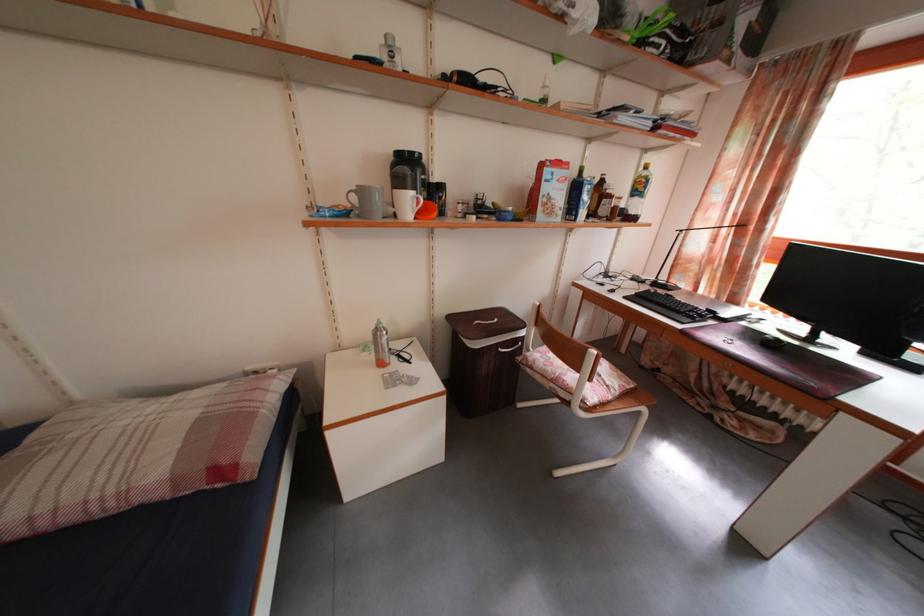
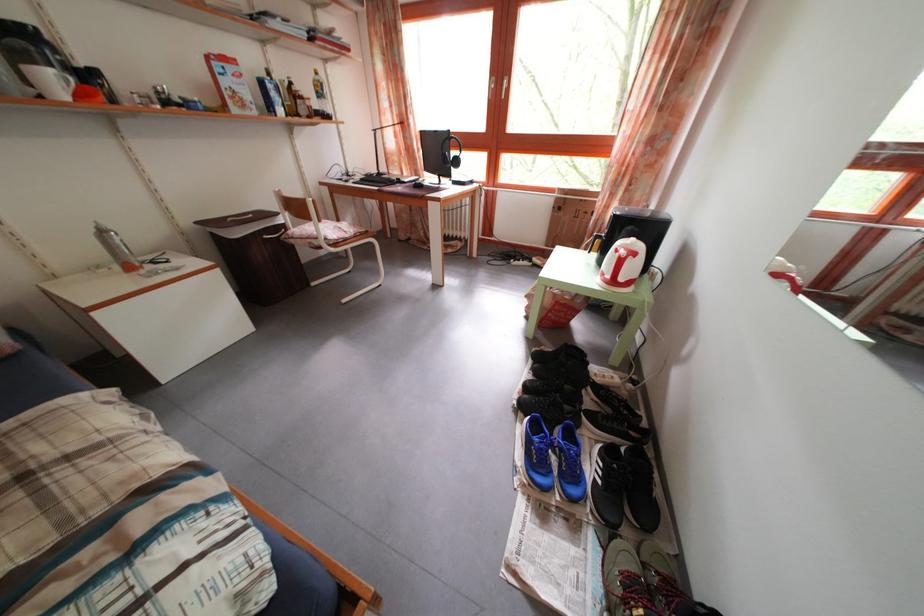
Locate, in the second image, the point that corresponds to [708,299] in the first image.

(412, 182)